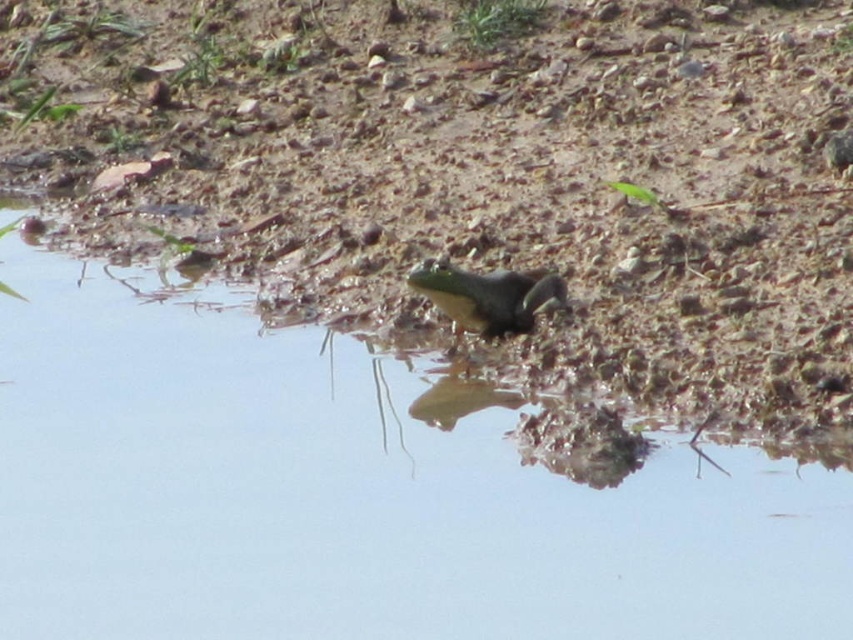
You are an environmental scientist observing the scene. You need to determine which object at the center has a bigger size between the dull brown dirt at center and the green matte frog at center. Which one is larger?

The dull brown dirt at center has a larger size compared to the green matte frog at center.

You are standing at the edge of the water and see the point marked at coordinates (x=479, y=172). What is located at that point?

The point at (x=479, y=172) indicates dull brown dirt at center.